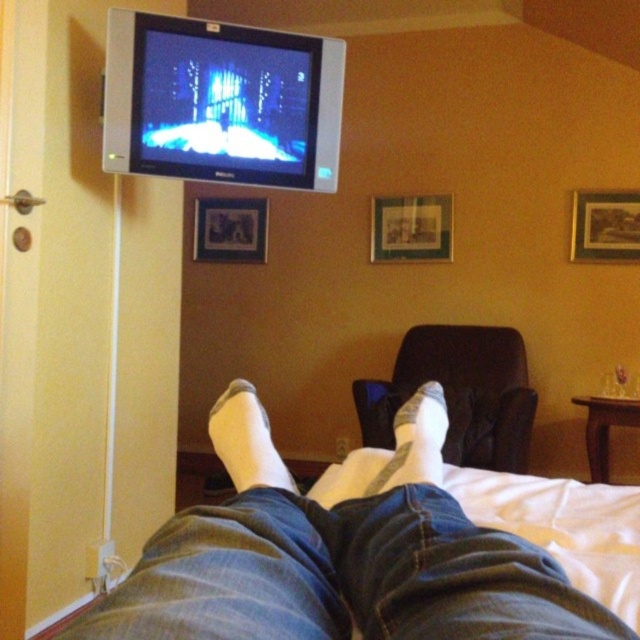
Question: Does white socks at lower center appear on the right side of wooden picture frame at center?

Choices:
 (A) no
 (B) yes

Answer: (A)

Question: Which of the following is the farthest from the observer?

Choices:
 (A) (256, 230)
 (B) (493, 362)
 (C) (234, 440)

Answer: (A)

Question: Estimate the real-world distances between objects in this image. Which object is farther from the white soft socks at lower center?

Choices:
 (A) white soft sock at lower center
 (B) matte plastic picture frame at center
 (C) brown leather armchair at lower center
 (D) white socks at lower center

Answer: (B)

Question: Can you confirm if wooden framed picture at upper right is smaller than matte plastic picture frame at center?

Choices:
 (A) no
 (B) yes

Answer: (B)

Question: Can you confirm if brown leather armchair at lower center is thinner than white sock at center?

Choices:
 (A) no
 (B) yes

Answer: (A)

Question: Which object appears closest to the camera in this image?

Choices:
 (A) wooden picture frame at center
 (B) white soft socks at lower center
 (C) white sock at center
 (D) wooden framed picture at upper right

Answer: (B)